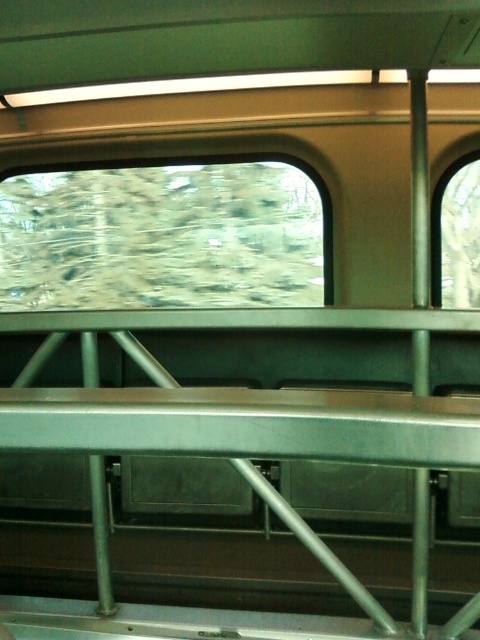
Describe the element at coordinates (162, 237) in the screenshot. I see `transparent glass window at center` at that location.

Does transparent glass window at center have a greater height compared to clear glass window at right?

Correct, transparent glass window at center is much taller as clear glass window at right.

Locate an element on the screen. transparent glass window at center is located at coordinates (162, 237).